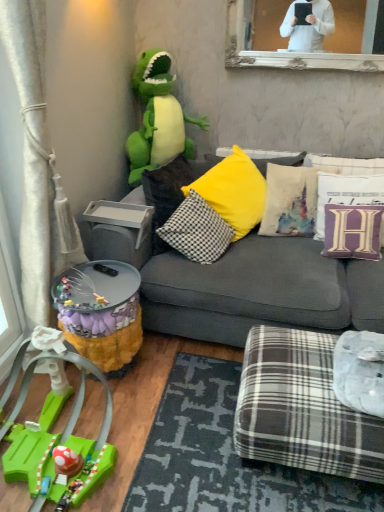
Question: Should I look upward or downward to see green plastic race track at lower left, acting as the second toy starting from the back?

Choices:
 (A) down
 (B) up

Answer: (A)

Question: Can you confirm if dark gray textured mat at lower center is positioned to the right of plaid fabric ottoman at lower right?

Choices:
 (A) no
 (B) yes

Answer: (A)

Question: Would you say dark gray textured mat at lower center is a long distance from plaid fabric ottoman at lower right?

Choices:
 (A) yes
 (B) no

Answer: (B)

Question: Is dark gray textured mat at lower center outside plaid fabric ottoman at lower right?

Choices:
 (A) yes
 (B) no

Answer: (A)

Question: Could you tell me if dark gray textured mat at lower center is turned towards plaid fabric ottoman at lower right?

Choices:
 (A) yes
 (B) no

Answer: (B)

Question: Is dark gray textured mat at lower center shorter than plaid fabric ottoman at lower right?

Choices:
 (A) no
 (B) yes

Answer: (B)

Question: Is dark gray textured mat at lower center bigger than plaid fabric ottoman at lower right?

Choices:
 (A) yes
 (B) no

Answer: (B)

Question: Does green plush dinosaur at upper left, positioned as the first toy in top-to-bottom order, have a lesser height compared to gray plastic tray at lower left?

Choices:
 (A) no
 (B) yes

Answer: (A)

Question: Can we say green plush dinosaur at upper left, placed as the 1th toy when sorted from back to front, lies outside gray plastic tray at lower left?

Choices:
 (A) yes
 (B) no

Answer: (A)

Question: Considering the relative sizes of green plush dinosaur at upper left, positioned as the first toy in top-to-bottom order, and gray plastic tray at lower left in the image provided, is green plush dinosaur at upper left, positioned as the first toy in top-to-bottom order, thinner than gray plastic tray at lower left?

Choices:
 (A) yes
 (B) no

Answer: (B)

Question: Is green plush dinosaur at upper left, placed as the 1th toy when sorted from back to front, at the left side of gray plastic tray at lower left?

Choices:
 (A) yes
 (B) no

Answer: (B)

Question: Considering the relative sizes of green plush dinosaur at upper left, placed as the 1th toy when sorted from back to front, and gray plastic tray at lower left in the image provided, is green plush dinosaur at upper left, placed as the 1th toy when sorted from back to front, wider than gray plastic tray at lower left?

Choices:
 (A) yes
 (B) no

Answer: (A)

Question: Could you tell me if green plush dinosaur at upper left, the 2th toy from the bottom, is turned towards gray plastic tray at lower left?

Choices:
 (A) yes
 (B) no

Answer: (A)

Question: From the image's perspective, does dark gray textured mat at lower center appear higher than purple velvet pillow at upper right, the first pillow from the right?

Choices:
 (A) no
 (B) yes

Answer: (A)